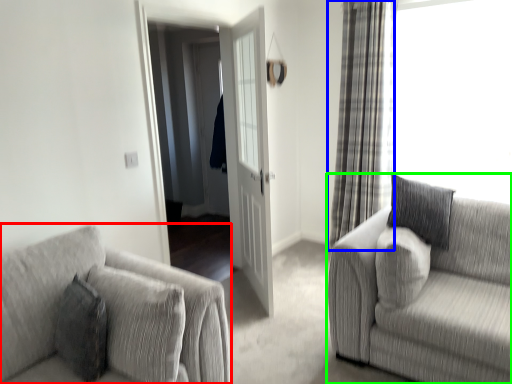
Question: Which is farther away from studio couch (highlighted by a red box)? curtain (highlighted by a blue box) or studio couch (highlighted by a green box)?

Choices:
 (A) curtain
 (B) studio couch

Answer: (A)